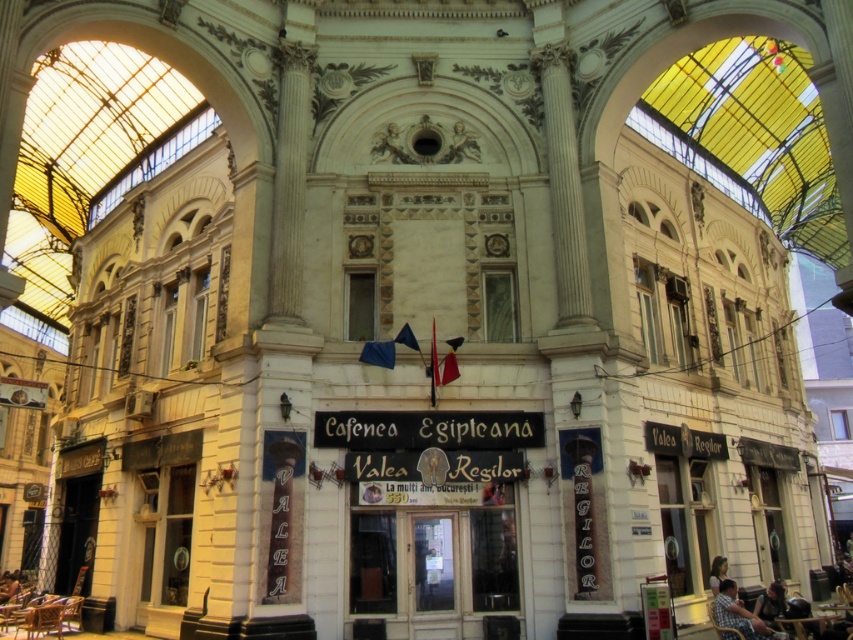
Question: Considering the relative positions of plaid shirt at lower right and dark blue fabric shirt at lower right in the image provided, where is plaid shirt at lower right located with respect to dark blue fabric shirt at lower right?

Choices:
 (A) left
 (B) right

Answer: (A)

Question: Which point is farther to the camera?

Choices:
 (A) blonde hair at lower right
 (B) dark blue fabric shirt at lower right
 (C) dark brown leather chair at lower left
 (D) plaid shirt at lower right

Answer: (C)

Question: Among these points, which one is farthest from the camera?

Choices:
 (A) (763, 608)
 (B) (3, 593)

Answer: (B)

Question: Is plaid shirt at lower right closer to camera compared to blonde hair at lower right?

Choices:
 (A) no
 (B) yes

Answer: (B)

Question: Is dark blue fabric shirt at lower right positioned behind dark brown leather chair at lower left?

Choices:
 (A) yes
 (B) no

Answer: (B)

Question: Which of the following is the farthest from the observer?

Choices:
 (A) blonde hair at lower right
 (B) dark blue fabric shirt at lower right

Answer: (A)